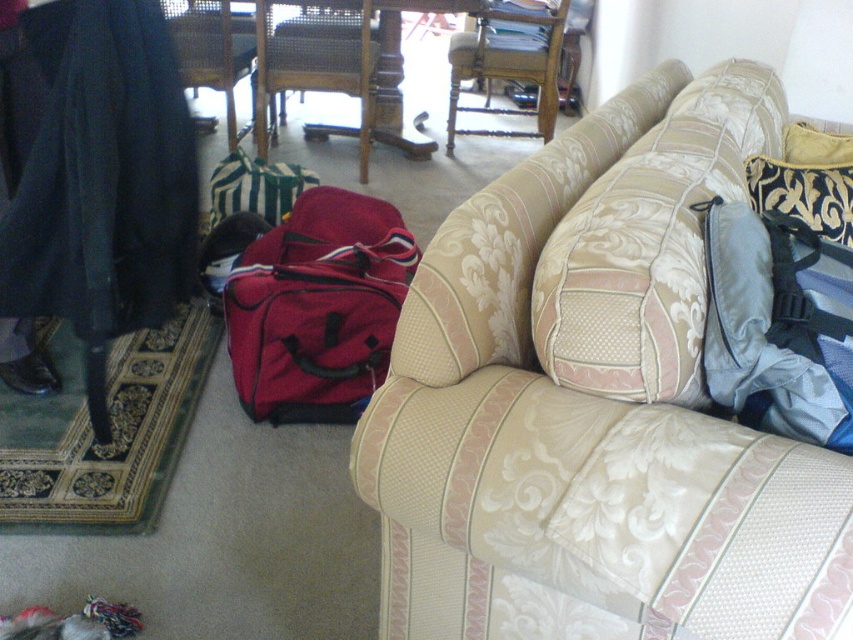
You are arranging a photo shoot in the living room and need to place two pillows on a shelf. The shelf has limited height space. Given the black velvet pillow at upper right and the velvet gold pillow at right, which one can you place without exceeding the shelf height limit if the limit is set to the height of the shorter pillow?

The velvet gold pillow at right is shorter than the black velvet pillow at upper right, so it can be placed on the shelf without exceeding the height limit.

You are organizing the living room and need to move the blue fabric bag at right and the wooden armchair at center. Which object is located to the right of the other?

The blue fabric bag at right is positioned on the right side of wooden armchair at center, so the blue fabric bag at right is to the right of the wooden armchair at center.

You are standing in the living room and want to place a new lamp on the rattan armchair at left. According to the scene description, where exactly is the rattan armchair located?

The rattan armchair at left is located at point (212, 51) in the scene.